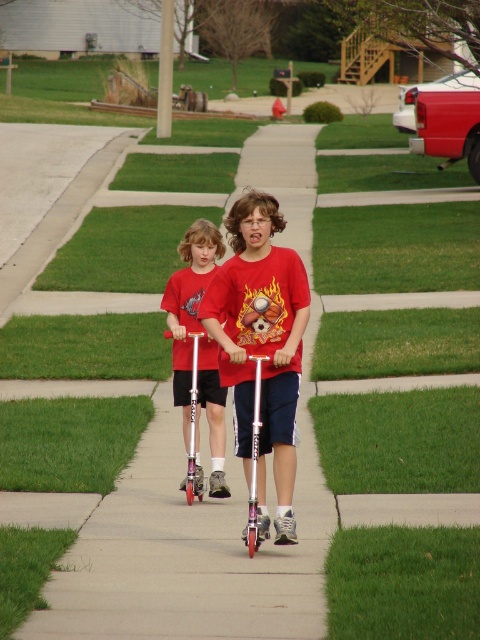
Between matte red t-shirt at center and matte red scooter at center, which one is positioned higher?

Positioned higher is matte red t-shirt at center.

Looking at this image, who is more distant from viewer, (289,310) or (186,444)?

Positioned behind is point (186,444).

Is point (262, 449) farther from viewer compared to point (226, 484)?

That is False.

Image resolution: width=480 pixels, height=640 pixels. Identify the location of matte red t-shirt at center. (261, 344).

Who is taller, smooth concrete sidewalk at center or matte red t-shirt at center?

Standing taller between the two is smooth concrete sidewalk at center.

Does smooth concrete sidewalk at center appear on the left side of matte red t-shirt at center?

No, smooth concrete sidewalk at center is not to the left of matte red t-shirt at center.

Based on the photo, who is more forward, (120, 596) or (278, 404)?

Point (120, 596)

At what (x,y) coordinates should I click in order to perform the action: click on smooth concrete sidewalk at center. Please return your answer as a coordinate pair (x, y). Image resolution: width=480 pixels, height=640 pixels. Looking at the image, I should click on (192, 547).

Which of these two, smooth concrete sidewalk at center or matte red scooter at center, stands shorter?

With less height is matte red scooter at center.

Is point (152, 584) behind point (181, 337)?

No, (152, 584) is in front of (181, 337).

Find the location of `smooth concrete sidewalk at center`. smooth concrete sidewalk at center is located at coordinates (192, 547).